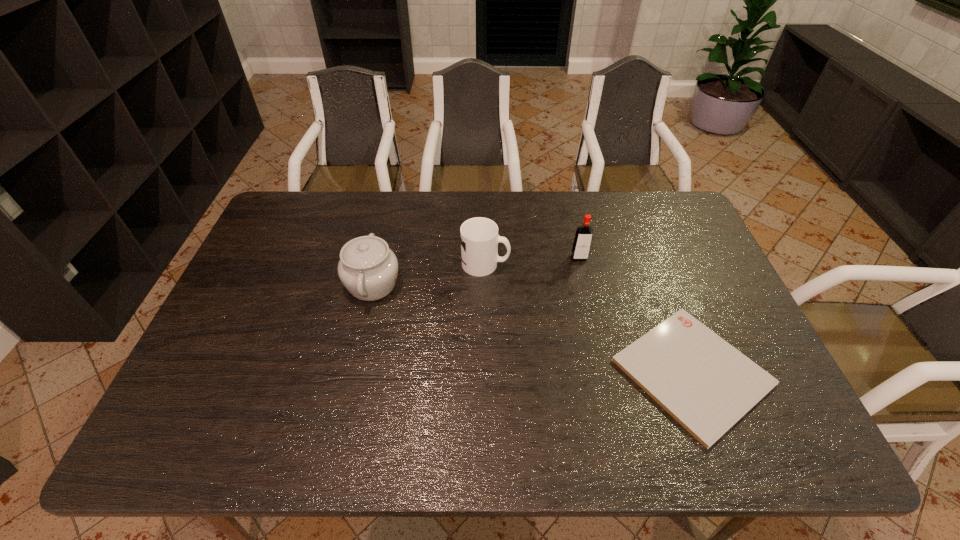
At what (x,y) coordinates should I click in order to perform the action: click on vacant area in the image that satisfies the following two spatial constraints: 1. on the front side of the chinaware; 2. on the right side of the clipboard. Please return your answer as a coordinate pair (x, y). Looking at the image, I should click on (352, 372).